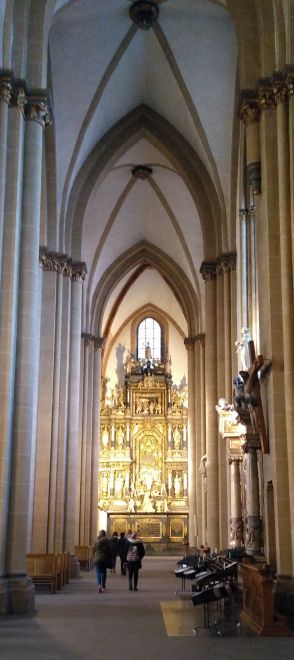
Identify the location of window. (149, 323).